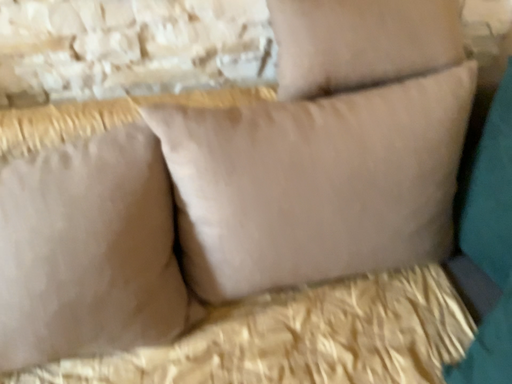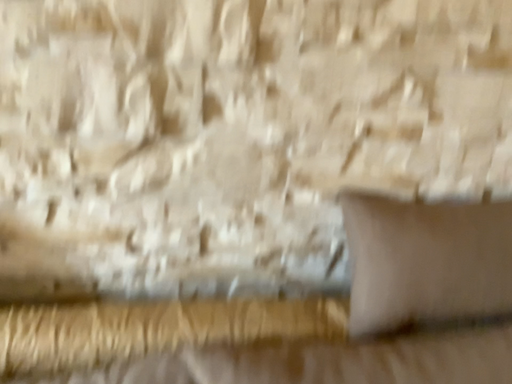
Question: How did the camera likely rotate when shooting the video?

Choices:
 (A) rotated upward
 (B) rotated downward

Answer: (A)